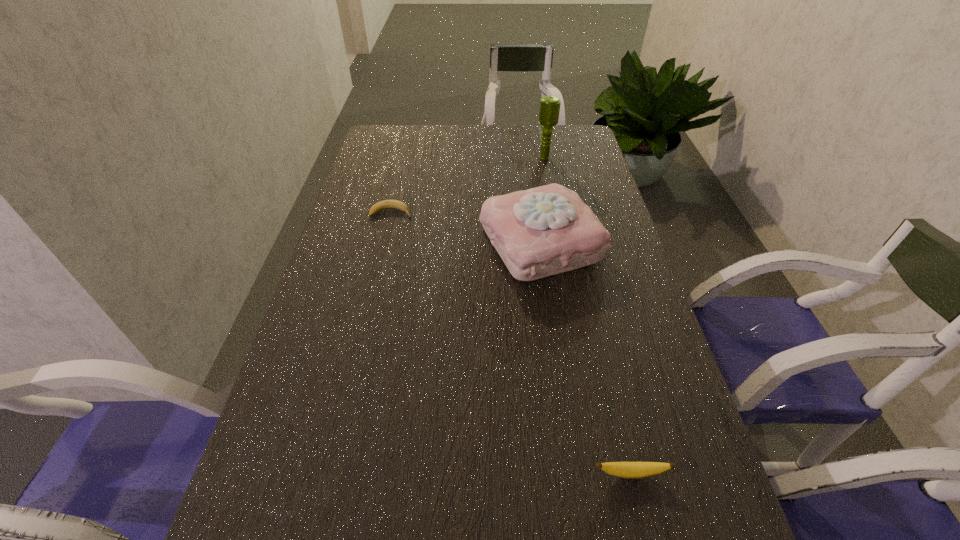
Locate an element on the screen. Image resolution: width=960 pixels, height=540 pixels. free space at the far left corner of the desktop is located at coordinates (391, 147).

Locate an element on the screen. The image size is (960, 540). vacant space at the far right corner of the desktop is located at coordinates (572, 135).

Locate an element on the screen. free space between the shorter banana and the farthest object is located at coordinates (468, 186).

This screenshot has width=960, height=540. In order to click on free space between the second tallest object and the taller banana in this screenshot , I will do `click(586, 357)`.

The height and width of the screenshot is (540, 960). Find the location of `empty location between the third shortest object and the shorter banana`. empty location between the third shortest object and the shorter banana is located at coordinates (467, 227).

Locate an element on the screen. This screenshot has width=960, height=540. vacant area between the microphone and the second shortest object is located at coordinates 588,316.

This screenshot has height=540, width=960. I want to click on vacant space that is in between the left banana and the second tallest object, so click(x=467, y=227).

At what (x,y) coordinates should I click in order to perform the action: click on free area in between the cake and the right banana. Please return your answer as a coordinate pair (x, y). This screenshot has height=540, width=960. Looking at the image, I should click on (586, 357).

Where is `vacant area between the microphone and the nearest object`? vacant area between the microphone and the nearest object is located at coordinates (588, 316).

The width and height of the screenshot is (960, 540). Identify the location of unoccupied area between the farthest object and the left banana. (468, 186).